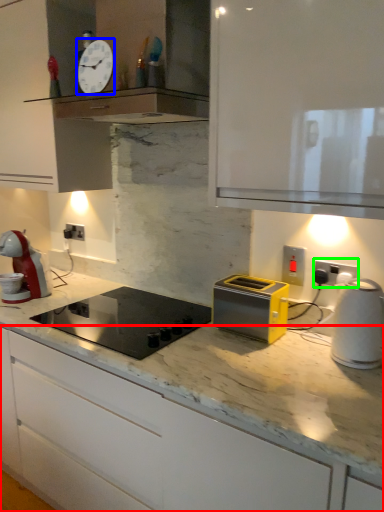
Question: Estimate the real-world distances between objects in this image. Which object is closer to cabinetry (highlighted by a red box), clock (highlighted by a blue box) or electric outlet (highlighted by a green box)?

Choices:
 (A) clock
 (B) electric outlet

Answer: (B)